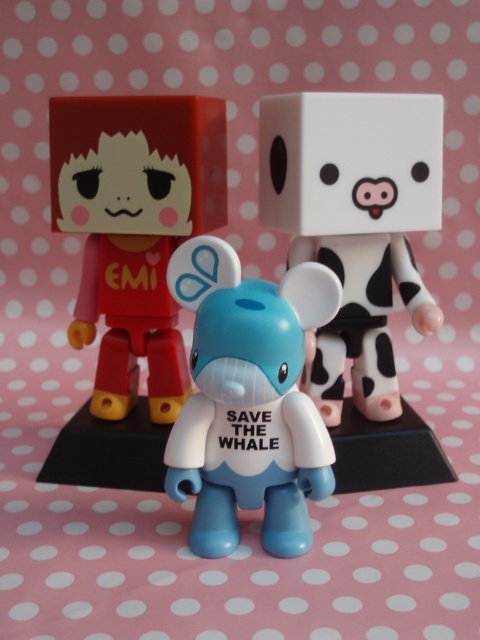
You are standing 2 feet away from the pink background. There is a matte red cube at left in front of you. Can you reach it without moving your feet?

The matte red cube at left is 3.29 feet away from the viewer. Since you are standing 2 feet away from the background, the distance between you and the cube is 1.29 feet. You can likely reach it without moving your feet.

You are a child trying to reach the blue matte toy at center and the white matte cube at center on a shelf. Which one can you reach first without moving the other?

The white matte cube at center can be reached first because the blue matte toy at center is behind it, making it closer to you.

You are a child trying to stack the white matte cube at center and the blue matte toy at center. Which one should you place on top to make a stable tower?

The white matte cube at center is already positioned over the blue matte toy at center, so to make a stable tower, you should keep the white matte cube at center on top of the blue matte toy at center.